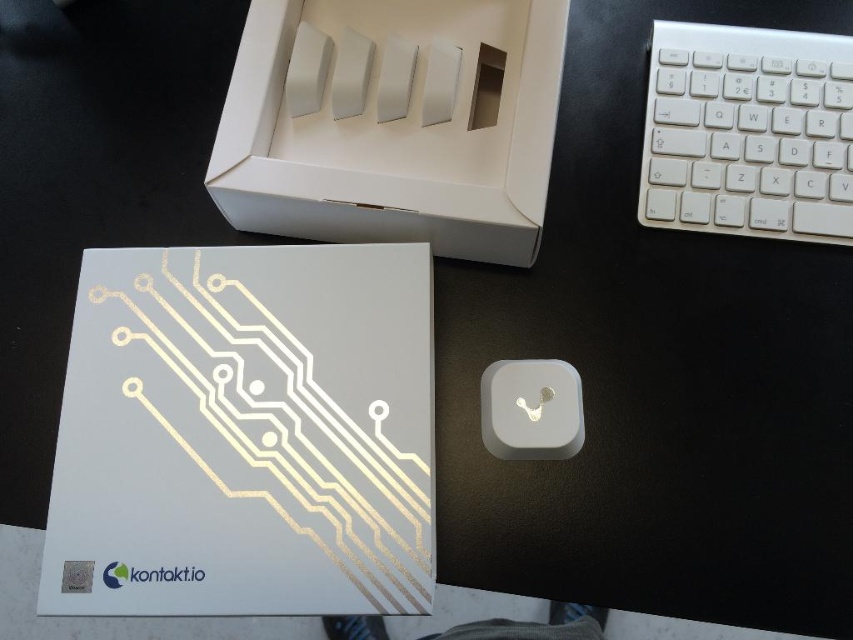
Question: Which is farther from the white plastic keyboard at upper right?

Choices:
 (A) white matte box at upper center
 (B) white matte mouse at center

Answer: (B)

Question: Which of the following is the closest to the observer?

Choices:
 (A) (228, 148)
 (B) (498, 444)

Answer: (A)

Question: Does white plastic keyboard at upper right appear under white matte mouse at center?

Choices:
 (A) no
 (B) yes

Answer: (A)

Question: Can you confirm if white plastic keyboard at upper right is bigger than white matte mouse at center?

Choices:
 (A) no
 (B) yes

Answer: (B)

Question: Is white plastic keyboard at upper right closer to camera compared to white matte mouse at center?

Choices:
 (A) yes
 (B) no

Answer: (B)

Question: Which object appears closest to the camera in this image?

Choices:
 (A) white matte box at upper center
 (B) white plastic keyboard at upper right

Answer: (A)